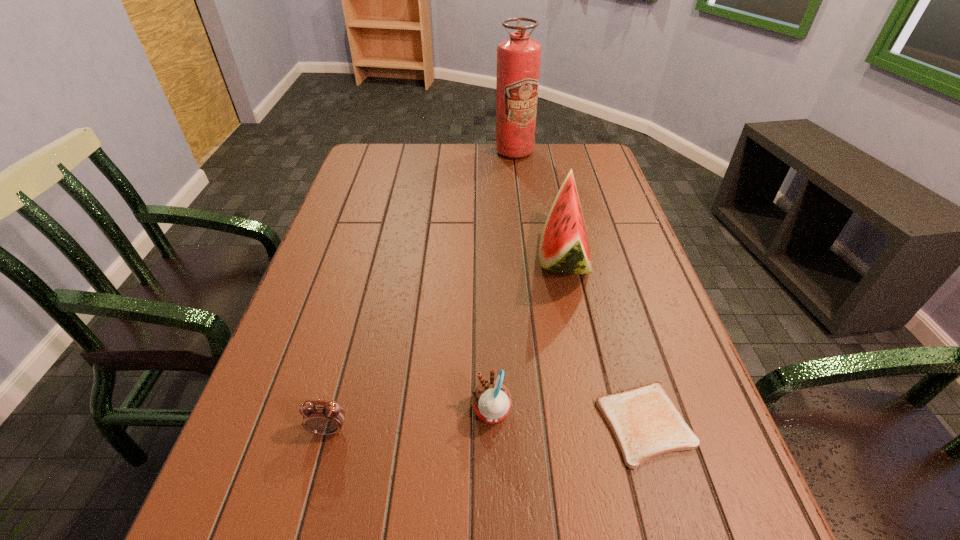
Where is `vacant space that satisfies the following two spatial constraints: 1. on the front-facing side of the muffin; 2. on the face of the leftmost object`? This screenshot has width=960, height=540. vacant space that satisfies the following two spatial constraints: 1. on the front-facing side of the muffin; 2. on the face of the leftmost object is located at coordinates (492, 429).

The image size is (960, 540). I want to click on vacant region that satisfies the following two spatial constraints: 1. on the label side of the farthest object; 2. on the front-facing side of the muffin, so click(545, 412).

Find the location of a particular element. This screenshot has width=960, height=540. blank area in the image that satisfies the following two spatial constraints: 1. on the label side of the fire extinguisher; 2. on the left side of the shortest object is located at coordinates (546, 424).

At what (x,y) coordinates should I click in order to perform the action: click on vacant point that satisfies the following two spatial constraints: 1. on the outer rind of the toast; 2. on the right side of the second tallest object. Please return your answer as a coordinate pair (x, y). The width and height of the screenshot is (960, 540). Looking at the image, I should click on pyautogui.click(x=599, y=424).

Locate an element on the screen. Image resolution: width=960 pixels, height=540 pixels. vacant space that satisfies the following two spatial constraints: 1. on the outer rind of the second farthest object; 2. on the face of the leftmost object is located at coordinates pyautogui.click(x=600, y=429).